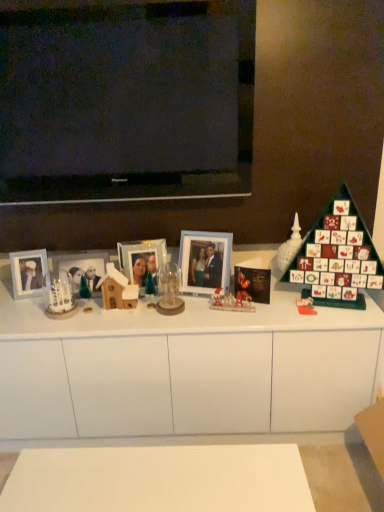
I want to click on vacant area located to the right-hand side of wooden house at center, arranged as the fifth toy when viewed from the right, so (x=154, y=312).